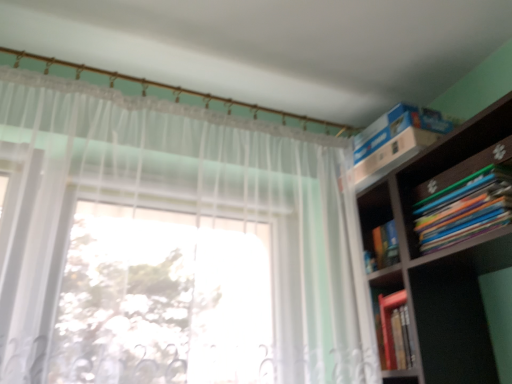
Question: Considering their positions, is white sheer curtain at upper left located in front of or behind multicolored paperbacks at upper right?

Choices:
 (A) front
 (B) behind

Answer: (A)

Question: From a real-world perspective, is white sheer curtain at upper left above or below multicolored paperbacks at upper right?

Choices:
 (A) below
 (B) above

Answer: (A)

Question: From their relative heights in the image, would you say white sheer curtain at upper left is taller or shorter than multicolored paperbacks at upper right?

Choices:
 (A) tall
 (B) short

Answer: (A)

Question: Is point (450, 208) positioned closer to the camera than point (47, 76)?

Choices:
 (A) closer
 (B) farther

Answer: (A)

Question: Looking at their shapes, would you say multicolored paperbacks at upper right is wider or thinner than white sheer curtain at upper left?

Choices:
 (A) thin
 (B) wide

Answer: (B)

Question: From the image's perspective, is multicolored paperbacks at upper right located above or below white sheer curtain at upper left?

Choices:
 (A) below
 (B) above

Answer: (B)

Question: Based on their positions, is multicolored paperbacks at upper right located to the left or right of white sheer curtain at upper left?

Choices:
 (A) right
 (B) left

Answer: (A)